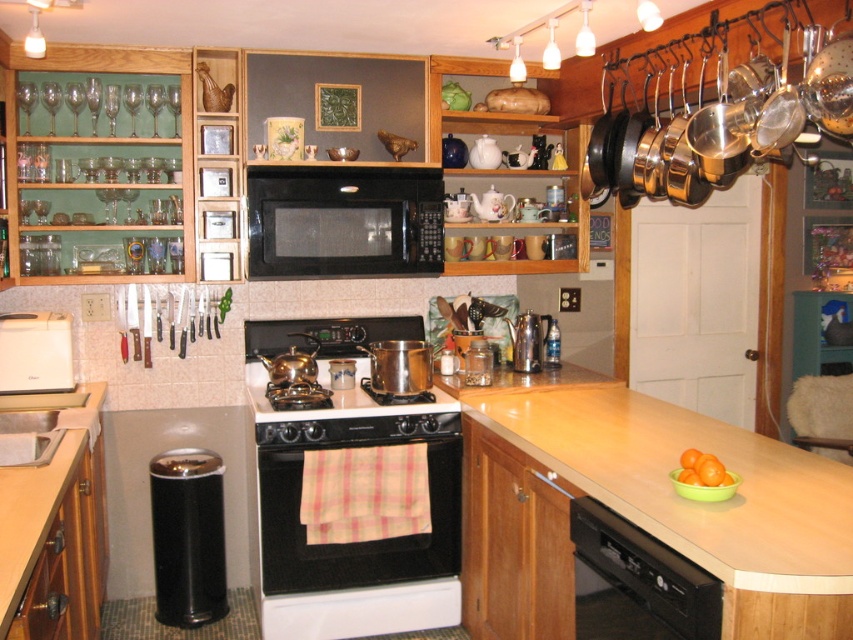
Is black matte microwave at center shorter than metallic silver shaker at center?

Incorrect, black matte microwave at center's height does not fall short of metallic silver shaker at center's.

Is black matte microwave at center wider than metallic silver shaker at center?

Indeed, black matte microwave at center has a greater width compared to metallic silver shaker at center.

Between point (347, 221) and point (538, 342), which one is positioned in front?

Point (347, 221)

In order to click on black matte microwave at center in this screenshot , I will do `click(343, 221)`.

What do you see at coordinates (354, 541) in the screenshot? This screenshot has height=640, width=853. I see `white glossy oven at center` at bounding box center [354, 541].

Can you confirm if white glossy oven at center is positioned above white plastic toaster at lower left?

Incorrect, white glossy oven at center is not positioned above white plastic toaster at lower left.

Identify the location of white glossy oven at center. The width and height of the screenshot is (853, 640). (354, 541).

Can you confirm if black matte microwave at center is shorter than metallic silver stove at center?

→ Yes, black matte microwave at center is shorter than metallic silver stove at center.

Does black matte microwave at center appear under metallic silver stove at center?

Incorrect, black matte microwave at center is not positioned below metallic silver stove at center.

Is point (326, 200) in front of point (281, 420)?

No, it is not.

Image resolution: width=853 pixels, height=640 pixels. Find the location of `black matte microwave at center`. black matte microwave at center is located at coordinates (343, 221).